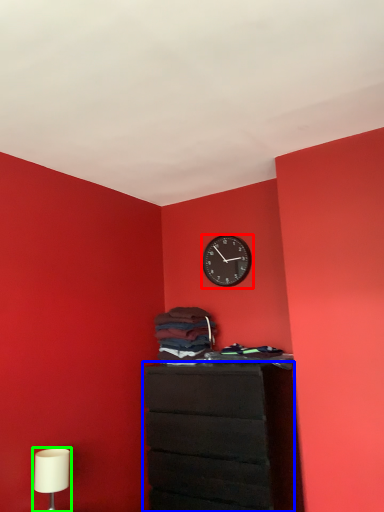
Question: Which is farther away from wall clock (highlighted by a red box)? chest of drawers (highlighted by a blue box) or table lamp (highlighted by a green box)?

Choices:
 (A) chest of drawers
 (B) table lamp

Answer: (B)